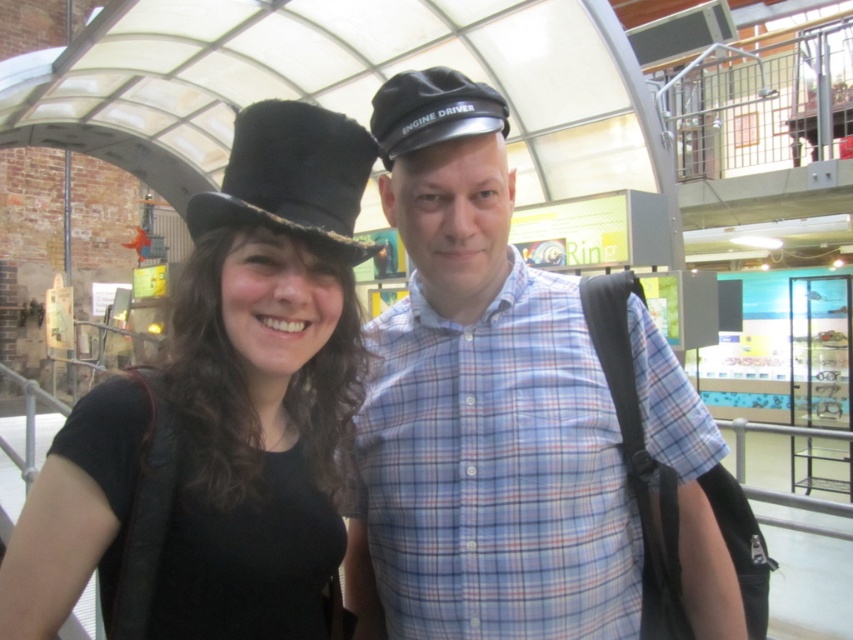
Does blue plaid shirt at center have a greater height compared to matte black hat at left?

Correct, blue plaid shirt at center is much taller as matte black hat at left.

How far apart are blue plaid shirt at center and matte black hat at left?

12.61 inches

Is point (491, 225) closer to viewer compared to point (189, 589)?

No, (491, 225) is behind (189, 589).

Identify the location of blue plaid shirt at center. This screenshot has height=640, width=853. (480, 406).

Is point (293, 188) closer to camera compared to point (434, 72)?

Yes, point (293, 188) is in front of point (434, 72).

Is point (341, 225) closer to camera compared to point (405, 144)?

That is True.

Locate an element on the screen. This screenshot has height=640, width=853. black felt dress hat at upper left is located at coordinates (292, 177).

Who is more forward, [386,394] or [263,176]?

Point [263,176] is in front.

Between blue plaid shirt at center and black felt dress hat at upper left, which one appears on the right side from the viewer's perspective?

blue plaid shirt at center is more to the right.

Where is `blue plaid shirt at center`? This screenshot has width=853, height=640. blue plaid shirt at center is located at coordinates (480, 406).